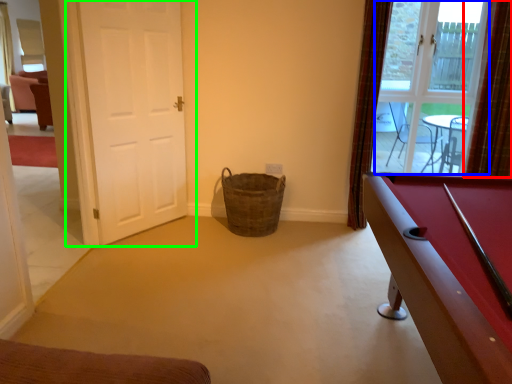
Question: Estimate the real-world distances between objects in this image. Which object is farther from curtain (highlighted by a red box), window screen (highlighted by a blue box) or door (highlighted by a green box)?

Choices:
 (A) window screen
 (B) door

Answer: (B)